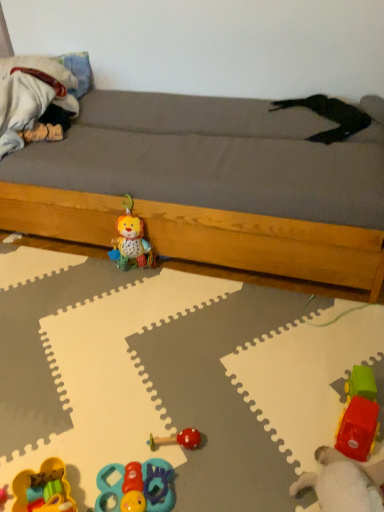
Locate an element on the screen. The image size is (384, 512). vacant space behind smooth plastic rattle at center, acting as the fourth toy starting from the left is located at coordinates (177, 391).